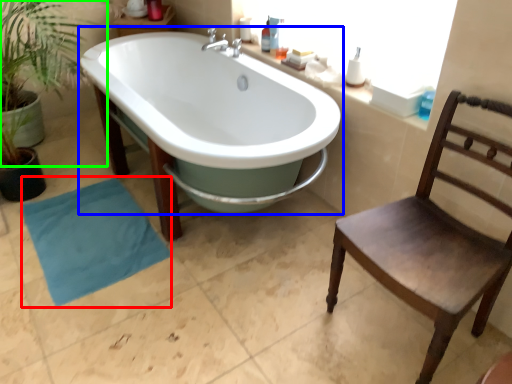
Question: Estimate the real-world distances between objects in this image. Which object is farther from beach towel (highlighted by a red box), bathtub (highlighted by a blue box) or vegetation (highlighted by a green box)?

Choices:
 (A) bathtub
 (B) vegetation

Answer: (B)